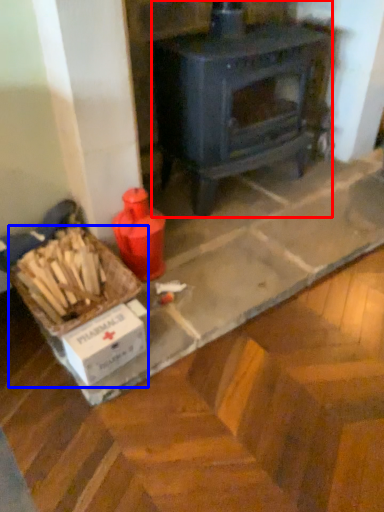
Question: Which point is further to the camera, wood burning stove (highlighted by a red box) or box (highlighted by a blue box)?

Choices:
 (A) wood burning stove
 (B) box

Answer: (A)